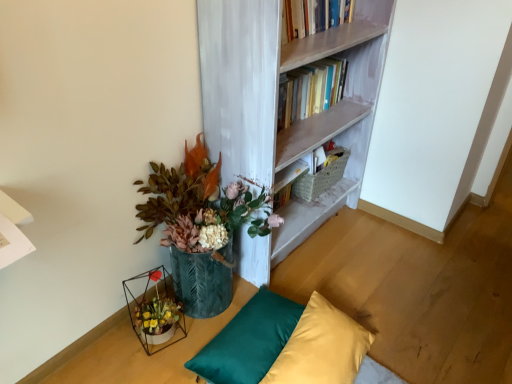
Question: From a real-world perspective, does metallic green vase at lower left sit lower than woven beige basket at upper center?

Choices:
 (A) no
 (B) yes

Answer: (A)

Question: Would you consider metallic green vase at lower left to be distant from woven beige basket at upper center?

Choices:
 (A) no
 (B) yes

Answer: (A)

Question: Is metallic green vase at lower left facing away from woven beige basket at upper center?

Choices:
 (A) no
 (B) yes

Answer: (A)

Question: Can you confirm if metallic green vase at lower left is bigger than woven beige basket at upper center?

Choices:
 (A) yes
 (B) no

Answer: (A)

Question: From a real-world perspective, is metallic green vase at lower left positioned over woven beige basket at upper center based on gravity?

Choices:
 (A) no
 (B) yes

Answer: (B)

Question: Does metallic green vase at lower left have a smaller size compared to woven beige basket at upper center?

Choices:
 (A) no
 (B) yes

Answer: (A)

Question: Does metallic wire table at lower left have a smaller size compared to white painted wood bookcase at upper center?

Choices:
 (A) yes
 (B) no

Answer: (A)

Question: Is there a large distance between metallic wire table at lower left and white painted wood bookcase at upper center?

Choices:
 (A) yes
 (B) no

Answer: (B)

Question: Does metallic wire table at lower left turn towards white painted wood bookcase at upper center?

Choices:
 (A) no
 (B) yes

Answer: (A)

Question: Is metallic wire table at lower left further to the viewer compared to white painted wood bookcase at upper center?

Choices:
 (A) yes
 (B) no

Answer: (A)

Question: Considering the relative sizes of metallic wire table at lower left and white painted wood bookcase at upper center in the image provided, is metallic wire table at lower left wider than white painted wood bookcase at upper center?

Choices:
 (A) yes
 (B) no

Answer: (B)

Question: Is metallic wire table at lower left at the right side of white painted wood bookcase at upper center?

Choices:
 (A) yes
 (B) no

Answer: (B)

Question: Is the depth of teal satin pillow at lower center, placed as the second pillow when sorted from right to left, greater than that of silky yellow pillow at lower center, which appears as the 1th pillow when viewed from the right?

Choices:
 (A) yes
 (B) no

Answer: (A)